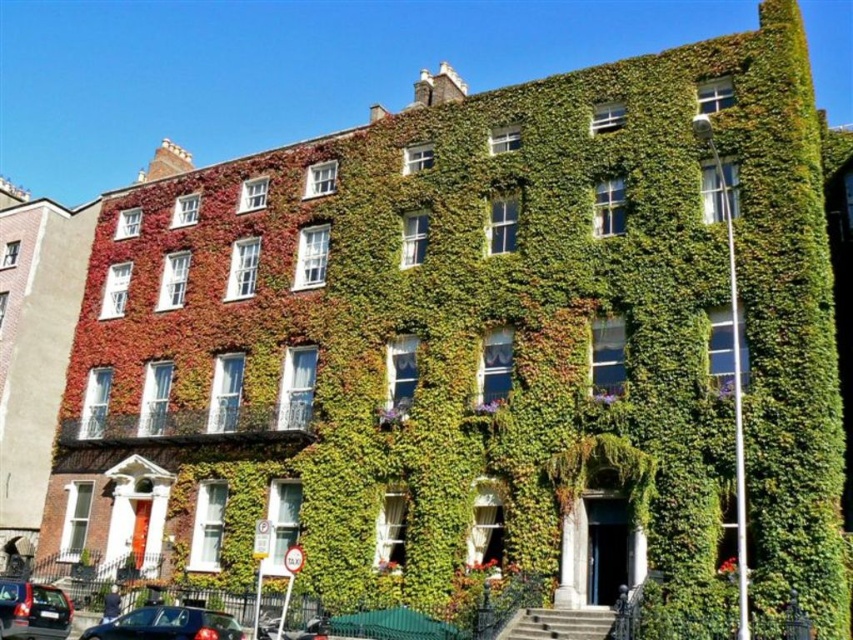
Question: Does shiny black car at lower left appear on the right side of metallic gray sedan at lower left?

Choices:
 (A) no
 (B) yes

Answer: (B)

Question: Is shiny black car at lower left to the left of metallic gray sedan at lower left from the viewer's perspective?

Choices:
 (A) yes
 (B) no

Answer: (B)

Question: Which point is closer to the camera?

Choices:
 (A) (21, 596)
 (B) (183, 624)

Answer: (B)

Question: Which point is closer to the camera taking this photo?

Choices:
 (A) (0, 602)
 (B) (202, 636)

Answer: (B)

Question: Can you confirm if shiny black car at lower left is positioned to the right of metallic gray sedan at lower left?

Choices:
 (A) no
 (B) yes

Answer: (B)